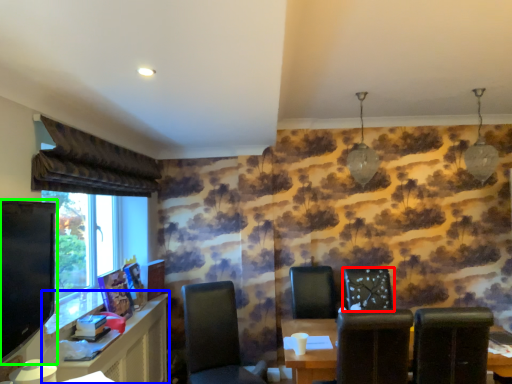
Question: Which object is the closest to the chair (highlighted by a red box)? Choose among these: computer desk (highlighted by a blue box) or television (highlighted by a green box).

Choices:
 (A) computer desk
 (B) television

Answer: (A)